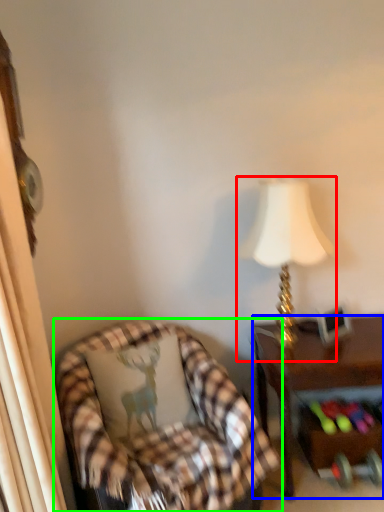
Question: Estimate the real-world distances between objects in this image. Which object is farther from lamp (highlighted by a red box), desk (highlighted by a blue box) or chair (highlighted by a green box)?

Choices:
 (A) desk
 (B) chair

Answer: (B)